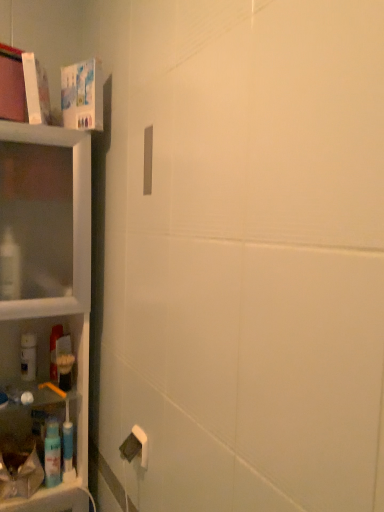
Question: In terms of width, does clear plastic shelf at left look wider or thinner when compared to blue plastic spray bottle at left, which ranks as the 2th cleaning product in top-to-bottom order?

Choices:
 (A) thin
 (B) wide

Answer: (B)

Question: From their relative heights in the image, would you say clear plastic shelf at left is taller or shorter than blue plastic spray bottle at left, which appears as the first cleaning product when viewed from the right?

Choices:
 (A) short
 (B) tall

Answer: (B)

Question: Which object is positioned closest to the white matte bottle at left, placed as the first cleaning product when sorted from top to bottom?

Choices:
 (A) translucent plastic mouthwash at lower left
 (B) clear plastic shelf at left
 (C) blue plastic spray bottle at left, which appears as the first cleaning product when viewed from the right

Answer: (A)

Question: Considering the real-world distances, which object is farthest from the blue plastic spray bottle at left, which is the 1th cleaning product from bottom to top?

Choices:
 (A) white matte bottle at left, which is the second cleaning product from bottom to top
 (B) clear plastic shelf at left
 (C) translucent plastic mouthwash at lower left

Answer: (B)